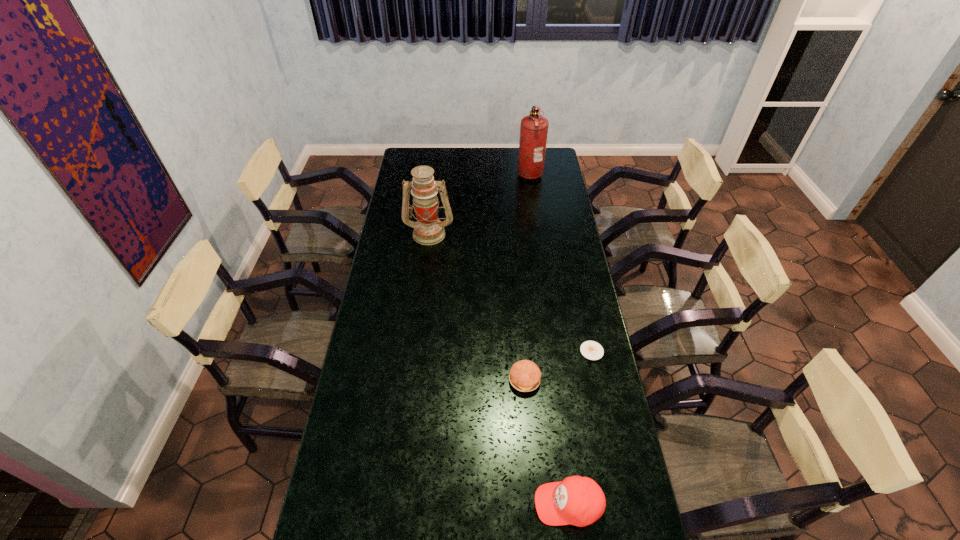
Find the location of `vacant space situated at the front of the farthest object where the nozzle is aimed`. vacant space situated at the front of the farthest object where the nozzle is aimed is located at coordinates (454, 172).

The image size is (960, 540). I want to click on free space located at the front of the farthest object where the nozzle is aimed, so click(488, 172).

Identify the location of free space located 0.190m on the right of the fourth shortest object. (495, 233).

This screenshot has height=540, width=960. I want to click on vacant point located 0.380m on the front panel of the third tallest object, so click(398, 504).

Locate an element on the screen. free spot located 0.400m on the front panel of the third tallest object is located at coordinates (391, 504).

At what (x,y) coordinates should I click in order to perform the action: click on free space located 0.380m on the front panel of the third tallest object. Please return your answer as a coordinate pair (x, y). Looking at the image, I should click on 398,504.

Find the location of `vacant region located 0.270m on the back of the second nearest object`. vacant region located 0.270m on the back of the second nearest object is located at coordinates (518, 307).

Identify the location of vacant space situated 0.390m on the back of the rightmost object. Image resolution: width=960 pixels, height=540 pixels. (574, 267).

In order to click on object that is at the far edge in this screenshot , I will do `click(534, 128)`.

Locate an element on the screen. The height and width of the screenshot is (540, 960). object at the left edge is located at coordinates pyautogui.click(x=428, y=230).